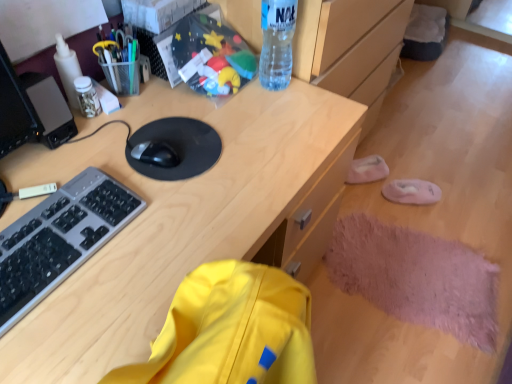
Identify the location of vacant area to the left of black matte mousepad at center. (92, 143).